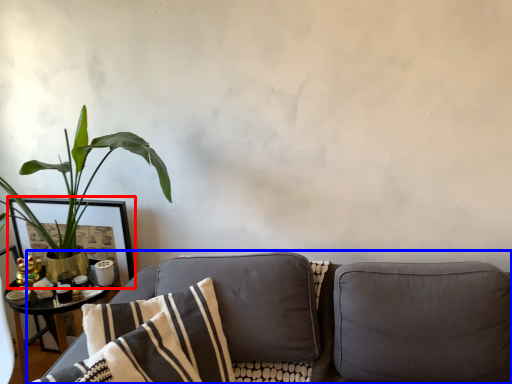
Question: Which object is closer to the camera taking this photo, picture frame (highlighted by a red box) or studio couch (highlighted by a blue box)?

Choices:
 (A) picture frame
 (B) studio couch

Answer: (B)